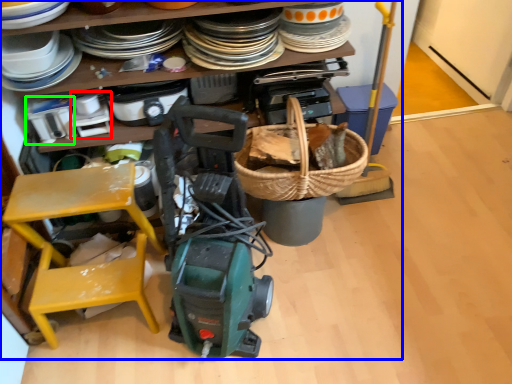
Question: Based on their relative distances, which object is nearer to appliance (highlighted by a red box)? Choose from collection (highlighted by a blue box) and appliance (highlighted by a green box).

Choices:
 (A) collection
 (B) appliance

Answer: (B)